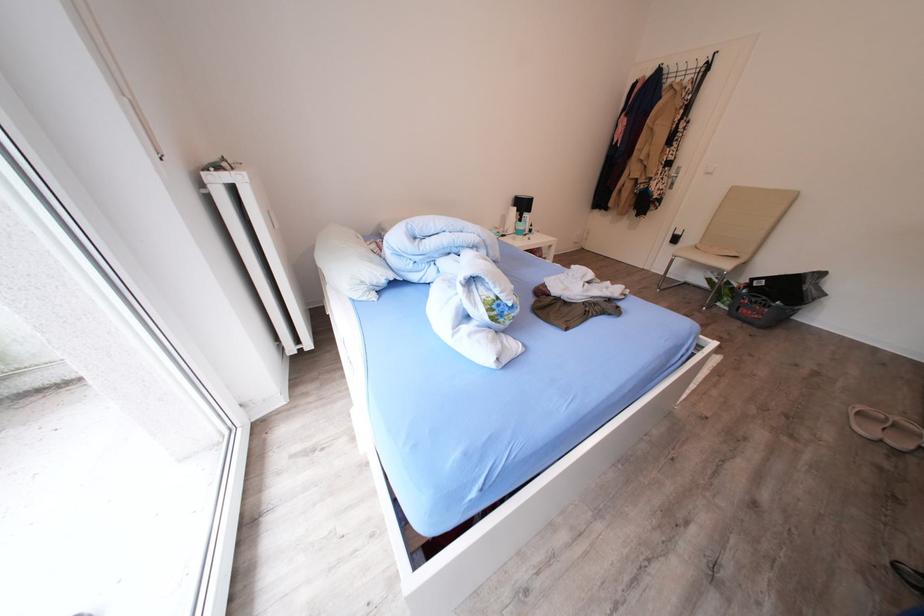
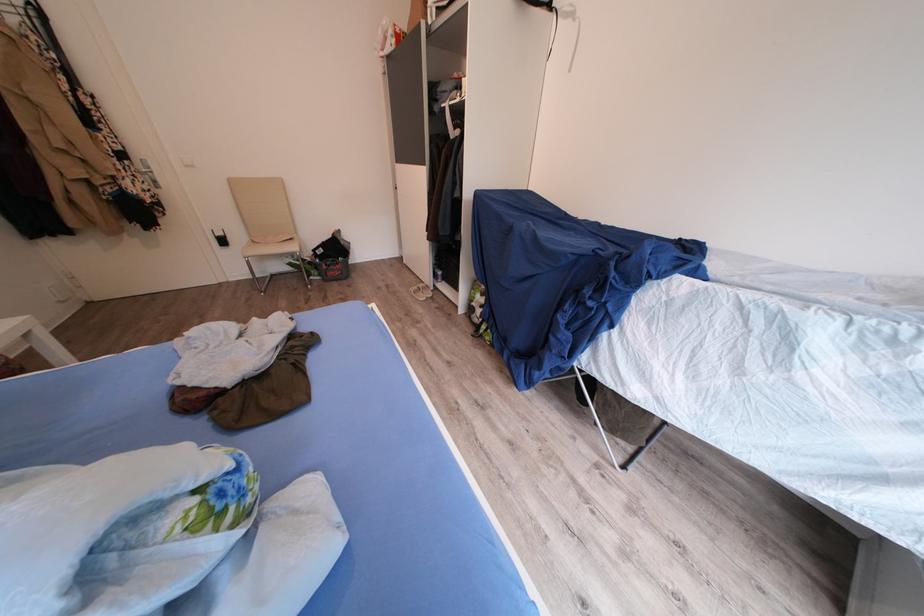
Locate, in the second image, the point that corresponds to (677,169) in the first image.

(130, 161)